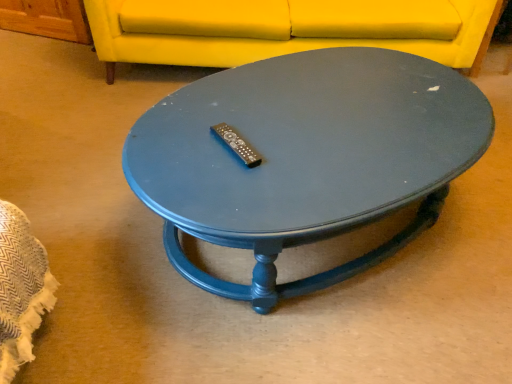
Question: Should I look upward or downward to see matte yellow fabric couch at upper center?

Choices:
 (A) up
 (B) down

Answer: (A)

Question: Is the surface of matte blue coffee table at center in direct contact with matte yellow fabric couch at upper center?

Choices:
 (A) yes
 (B) no

Answer: (B)

Question: Is matte blue coffee table at center not inside matte yellow fabric couch at upper center?

Choices:
 (A) no
 (B) yes

Answer: (B)

Question: From the image's perspective, is matte blue coffee table at center on top of matte yellow fabric couch at upper center?

Choices:
 (A) no
 (B) yes

Answer: (A)

Question: Is matte blue coffee table at center behind matte yellow fabric couch at upper center?

Choices:
 (A) no
 (B) yes

Answer: (A)

Question: Are matte blue coffee table at center and matte yellow fabric couch at upper center located far from each other?

Choices:
 (A) yes
 (B) no

Answer: (B)

Question: Is matte blue coffee table at center turned away from matte yellow fabric couch at upper center?

Choices:
 (A) no
 (B) yes

Answer: (B)

Question: Considering the relative positions of matte yellow fabric couch at upper center and matte blue coffee table at center in the image provided, is matte yellow fabric couch at upper center in front of matte blue coffee table at center?

Choices:
 (A) yes
 (B) no

Answer: (B)

Question: Is matte yellow fabric couch at upper center shorter than matte blue coffee table at center?

Choices:
 (A) yes
 (B) no

Answer: (B)

Question: Considering the relative sizes of matte yellow fabric couch at upper center and matte blue coffee table at center in the image provided, is matte yellow fabric couch at upper center taller than matte blue coffee table at center?

Choices:
 (A) yes
 (B) no

Answer: (A)

Question: Can we say matte yellow fabric couch at upper center lies outside matte blue coffee table at center?

Choices:
 (A) yes
 (B) no

Answer: (A)

Question: From a real-world perspective, is matte yellow fabric couch at upper center located higher than matte blue coffee table at center?

Choices:
 (A) yes
 (B) no

Answer: (A)

Question: Is matte yellow fabric couch at upper center to the right of matte blue coffee table at center from the viewer's perspective?

Choices:
 (A) yes
 (B) no

Answer: (B)

Question: Choose the correct answer: Is matte blue coffee table at center inside matte yellow fabric couch at upper center or outside it?

Choices:
 (A) outside
 (B) inside

Answer: (A)